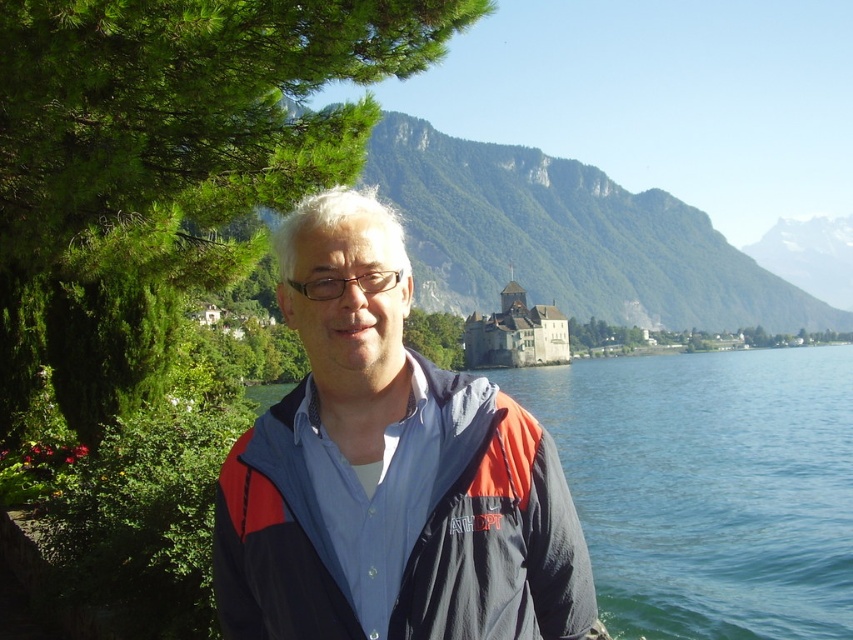
Based on the scene description, which object is closer to the observer, the blue water at center or the stone castle at center?

The blue water at center is closer to the observer than the stone castle at center because it is positioned in front of it.

You are a hiker planning to take a photo of the stone castle at center and the green grassy mountain at center from a viewpoint. Which object will appear higher in your photo?

The green grassy mountain at center will appear higher in the photo because it is positioned above the stone castle at center according to the description.